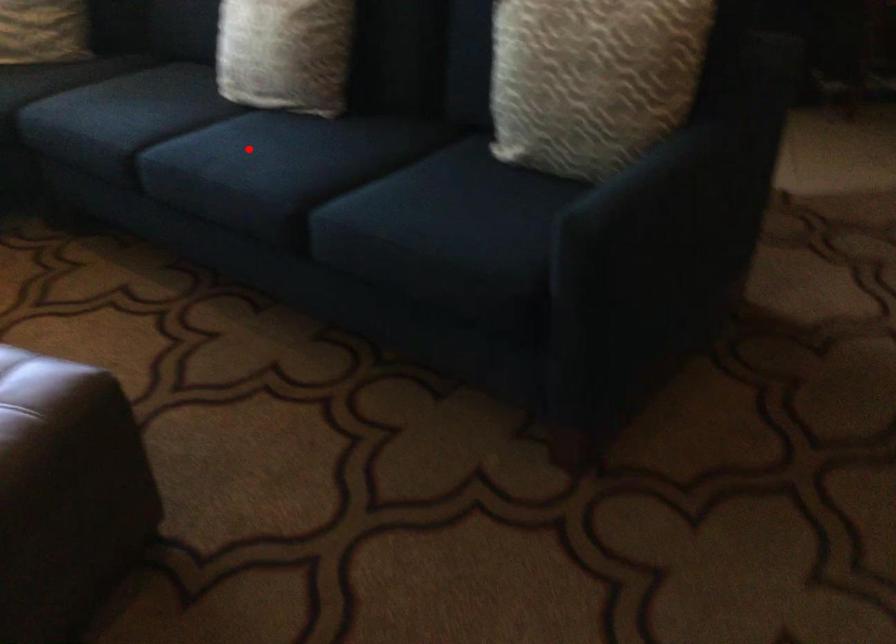
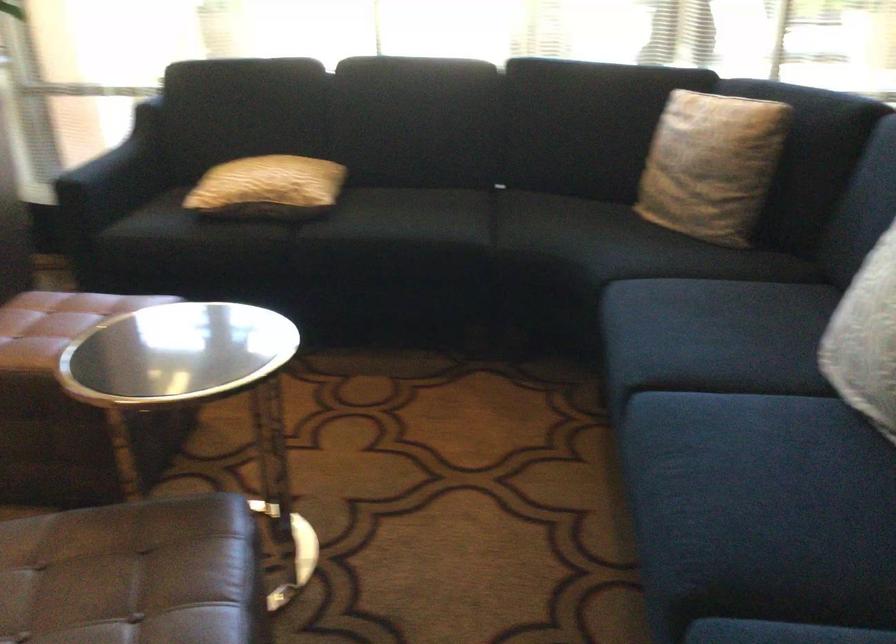
Question: I am providing you with two images of the same scene from different viewpoints. In image1, a red point is highlighted. Considering the same 3D point in image2, which of the following is correct?

Choices:
 (A) It is closer
 (B) It is farther

Answer: (A)